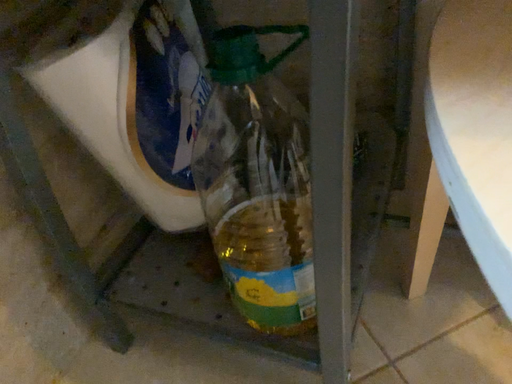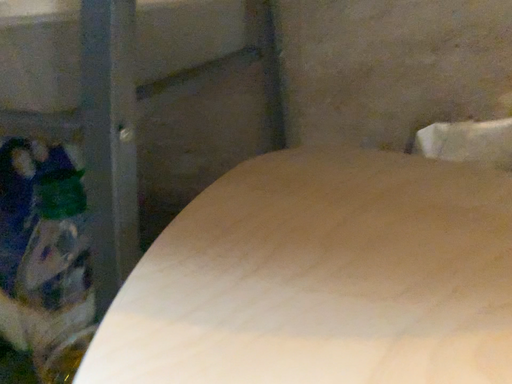
Question: Which way did the camera rotate in the video?

Choices:
 (A) rotated right
 (B) rotated left

Answer: (A)